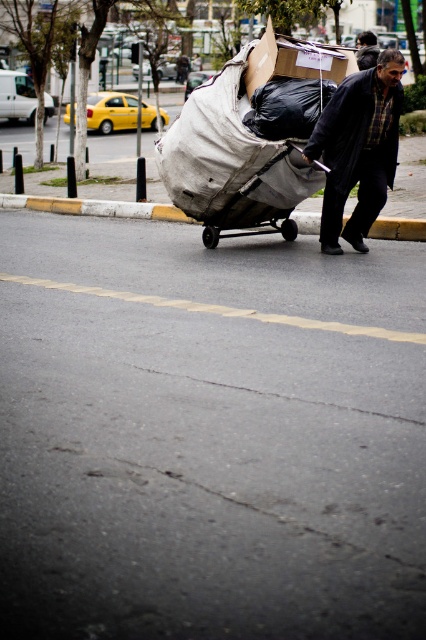
Which is above, dark blue jacket at center or matte black jacket at center?

Positioned higher is matte black jacket at center.

Who is more distant from viewer, (351, 115) or (356, 56)?

The point (356, 56) is more distant.

This screenshot has width=426, height=640. Find the location of `dark blue jacket at center`. dark blue jacket at center is located at coordinates (359, 148).

Which is more to the left, dark blue jacket at center or yellow concrete curb at lower center?

Positioned to the left is dark blue jacket at center.

Does dark blue jacket at center appear on the left side of yellow concrete curb at lower center?

Yes, dark blue jacket at center is to the left of yellow concrete curb at lower center.

Between point (330, 220) and point (420, 227), which one is positioned behind?

The point (420, 227) is behind.

This screenshot has height=640, width=426. In order to click on dark blue jacket at center in this screenshot , I will do `click(359, 148)`.

Can you confirm if yellow concrete curb at lower center is bigger than matte black jacket at center?

No, yellow concrete curb at lower center is not bigger than matte black jacket at center.

Does yellow concrete curb at lower center appear under matte black jacket at center?

Indeed, yellow concrete curb at lower center is positioned under matte black jacket at center.

The height and width of the screenshot is (640, 426). I want to click on yellow concrete curb at lower center, so click(x=94, y=208).

At what (x,y) coordinates should I click in order to perform the action: click on yellow concrete curb at lower center. Please return your answer as a coordinate pair (x, y). Image resolution: width=426 pixels, height=640 pixels. Looking at the image, I should click on (94, 208).